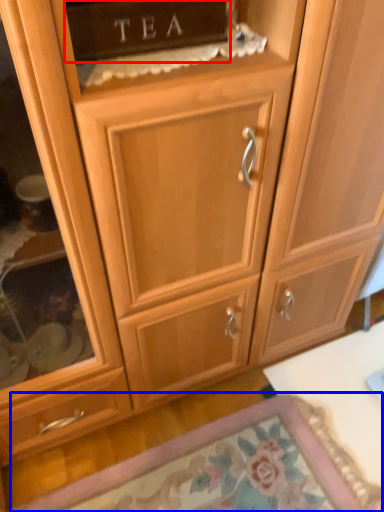
Question: Among these objects, which one is farthest to the camera, cabinetry (highlighted by a red box) or door (highlighted by a blue box)?

Choices:
 (A) cabinetry
 (B) door

Answer: (B)